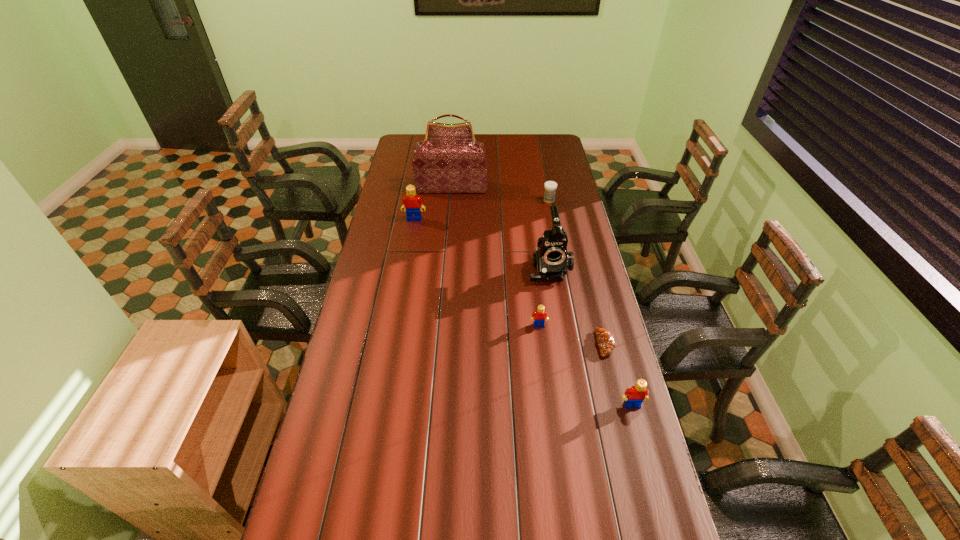
Please point a spot to place another Lego for symmetrical spacing. Please provide its 2D coordinates. Your answer should be formatted as a tuple, i.e. [(x, y)], where the tuple contains the x and y coordinates of a point satisfying the conditions above.

[(468, 266)]